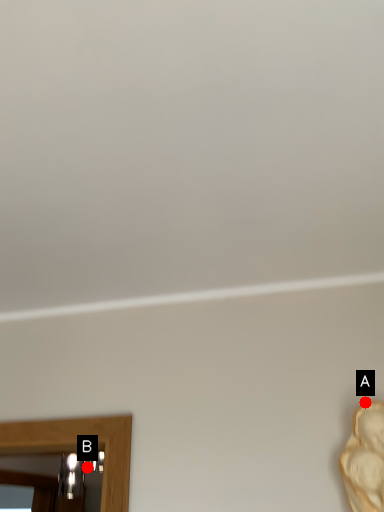
Question: Two points are circled on the image, labeled by A and B beside each circle. Which point appears farthest from the camera in this image?

Choices:
 (A) A is further
 (B) B is further

Answer: (B)